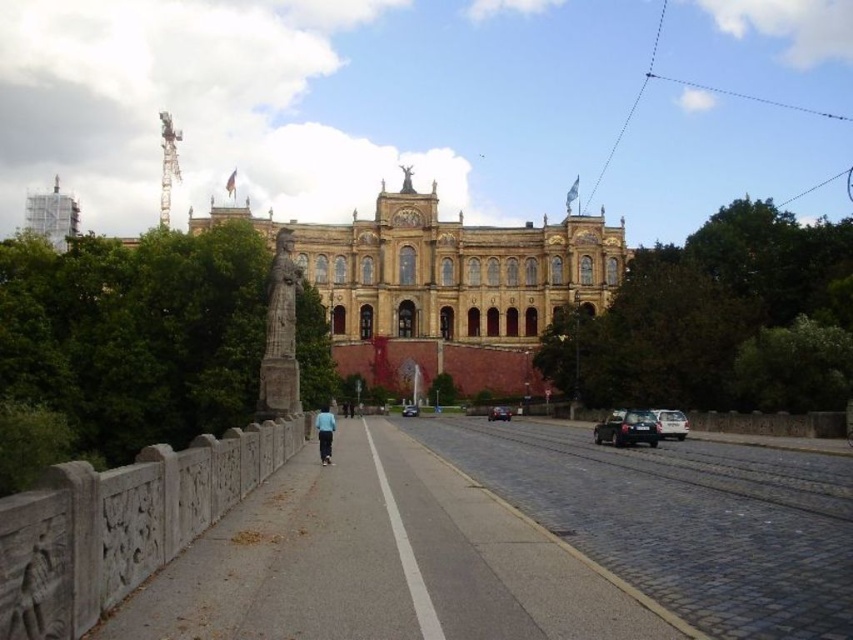
Is brown stone building at center bigger than shiny black sedan at center?

Correct, brown stone building at center is larger in size than shiny black sedan at center.

Where is `brown stone building at center`? The width and height of the screenshot is (853, 640). brown stone building at center is located at coordinates (445, 288).

Is the position of blue fabric shirt at center more distant than that of shiny black sedan at center?

No.

Is point (322, 410) positioned in front of point (495, 410)?

Yes, point (322, 410) is in front of point (495, 410).

Does point (323, 445) come farther from viewer compared to point (495, 412)?

No, (323, 445) is closer to viewer.

At what (x,y) coordinates should I click in order to perform the action: click on blue fabric shirt at center. Please return your answer as a coordinate pair (x, y). Looking at the image, I should click on (323, 433).

Is shiny black car at right to the left of blue fabric shirt at center from the viewer's perspective?

In fact, shiny black car at right is to the right of blue fabric shirt at center.

Describe the element at coordinates (627, 428) in the screenshot. The height and width of the screenshot is (640, 853). I see `shiny black car at right` at that location.

Identify the location of shiny black car at right. The image size is (853, 640). (627, 428).